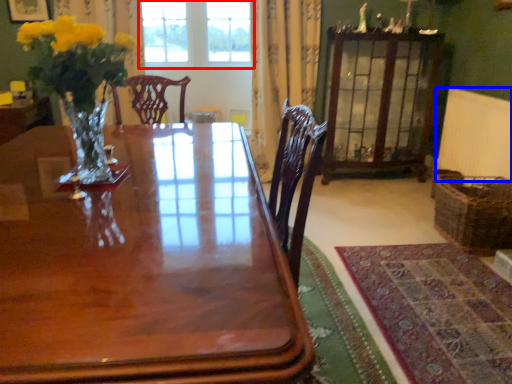
Question: Which object appears farthest to the camera in this image, window (highlighted by a red box) or radiator (highlighted by a blue box)?

Choices:
 (A) window
 (B) radiator

Answer: (A)